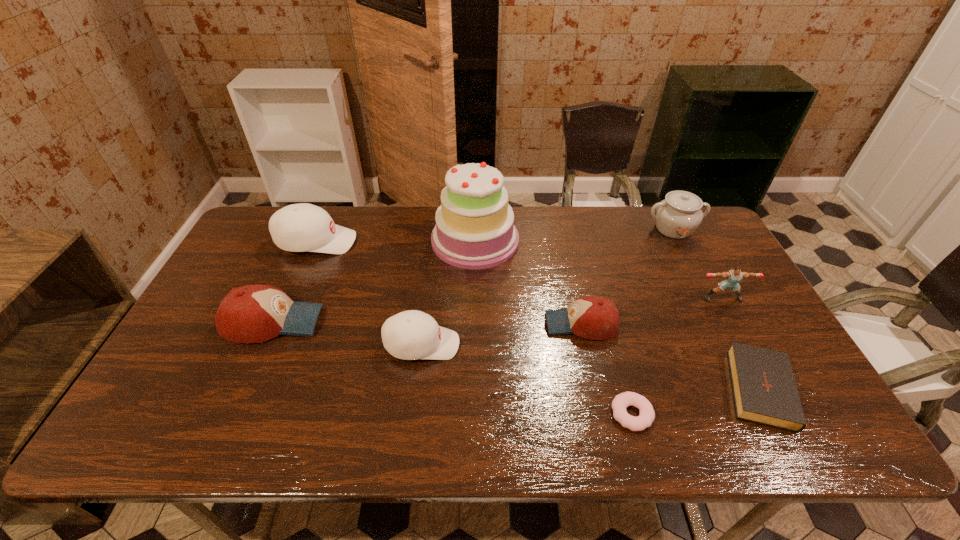
What are the coordinates of `vacant point located between the puncher and the shortest object` in the screenshot? It's located at (677, 356).

Locate an element on the screen. object identified as the fourth closest to the bigger red baseball cap is located at coordinates (591, 317).

Choose which object is the third nearest neighbor to the right red baseball cap. Please provide its 2D coordinates. Your answer should be formatted as a tuple, i.e. [(x, y)], where the tuple contains the x and y coordinates of a point satisfying the conditions above.

[(764, 389)]

At what (x,y) coordinates should I click in order to perform the action: click on the closest baseball cap relative to the bigger red baseball cap. Please return your answer as a coordinate pair (x, y). The image size is (960, 540). Looking at the image, I should click on (302, 227).

Locate an element on the screen. The height and width of the screenshot is (540, 960). baseball cap that stands as the third closest to the nearer white baseball cap is located at coordinates point(302,227).

I want to click on vacant space that satisfies the following two spatial constraints: 1. on the front-facing side of the left red baseball cap; 2. on the back side of the shortest object, so click(233, 414).

Locate an element on the screen. Image resolution: width=960 pixels, height=540 pixels. vacant space that satisfies the following two spatial constraints: 1. on the front-facing side of the red puncher; 2. on the front-facing side of the smaller red baseball cap is located at coordinates (737, 324).

At what (x,y) coordinates should I click in order to perform the action: click on free space that satisfies the following two spatial constraints: 1. on the front-facing side of the Bible; 2. on the right side of the bigger red baseball cap. Please return your answer as a coordinate pair (x, y). The width and height of the screenshot is (960, 540). Looking at the image, I should click on (245, 387).